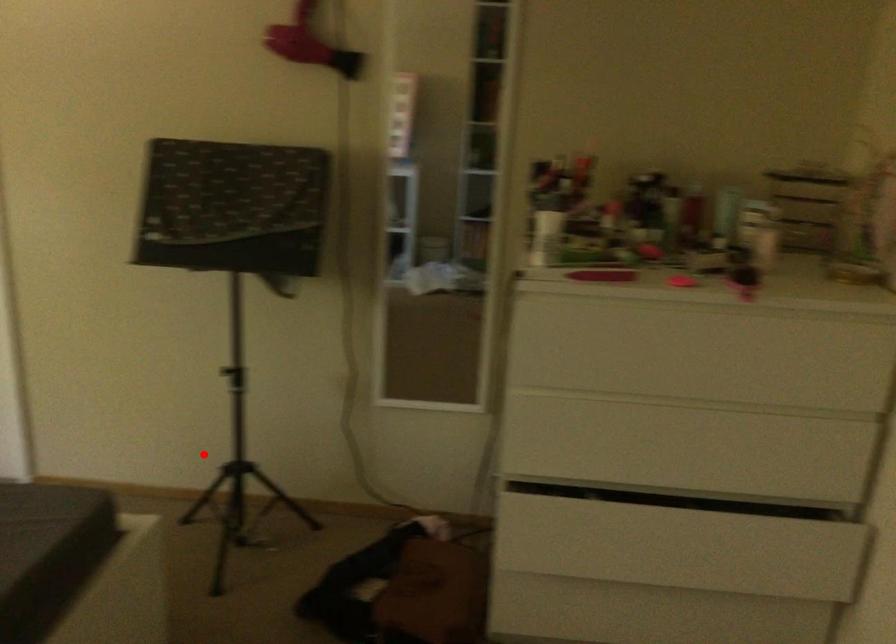
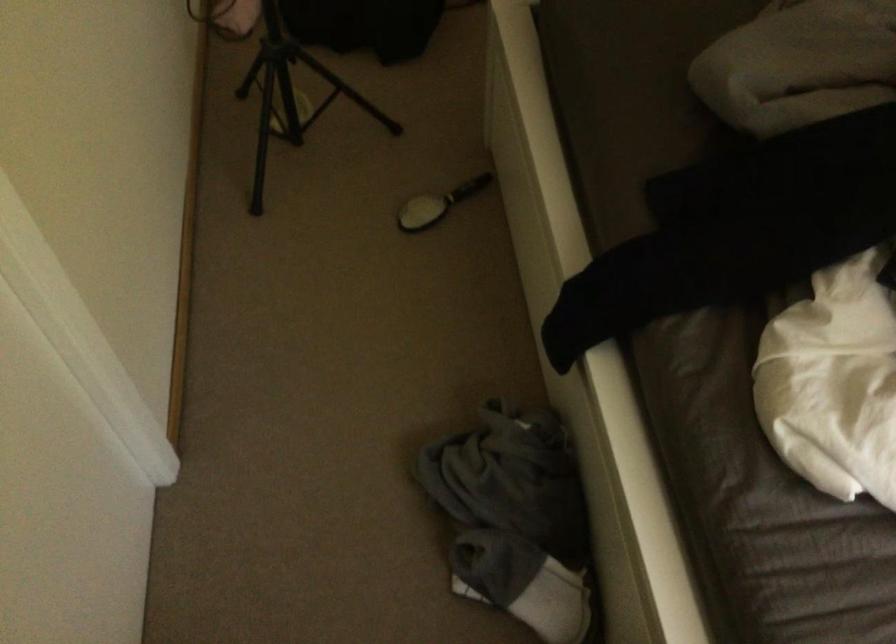
Question: I am providing you with two images of the same scene from different viewpoints. Image1 has a red point marked. In image2, the corresponding 3D location appears at what relative position? Reply with the corresponding letter.

Choices:
 (A) Closer
 (B) Farther

Answer: (A)